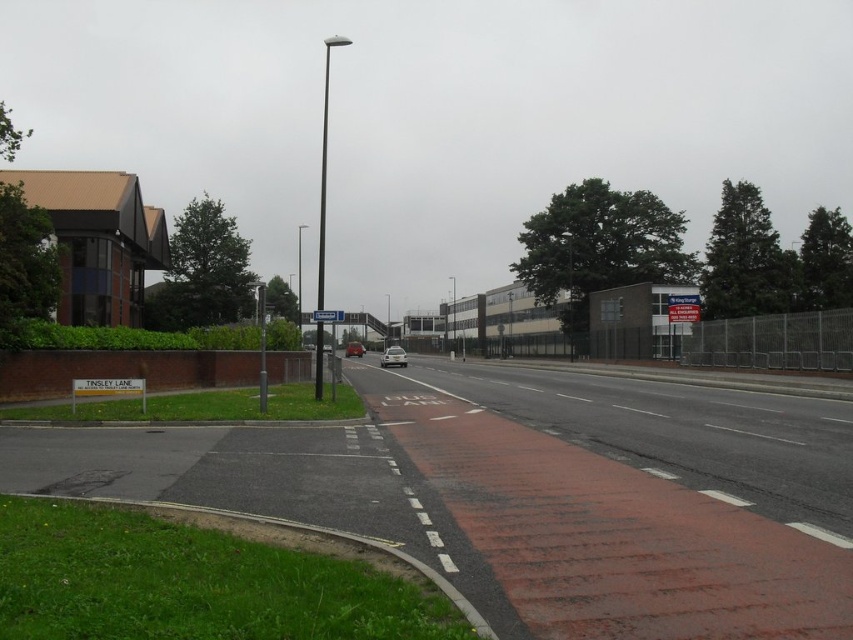
Who is more forward, (x=830, y=529) or (x=363, y=353)?

Point (x=830, y=529) is more forward.

Looking at this image, between red brick sidewalk at center and matte silver car at center, which one appears on the left side from the viewer's perspective?

From the viewer's perspective, matte silver car at center appears more on the left side.

Is point (761, 420) in front of point (347, 346)?

Yes.

I want to click on red brick sidewalk at center, so click(x=635, y=499).

Does red brick sidewalk at center have a smaller size compared to silver metallic car at center?

Correct, red brick sidewalk at center occupies less space than silver metallic car at center.

Does red brick sidewalk at center appear on the left side of silver metallic car at center?

In fact, red brick sidewalk at center is to the right of silver metallic car at center.

Does point (540, 564) come behind point (395, 355)?

No.

Find the location of a particular element. This screenshot has height=640, width=853. red brick sidewalk at center is located at coordinates (635, 499).

Is silver metallic car at center smaller than matte silver car at center?

Indeed, silver metallic car at center has a smaller size compared to matte silver car at center.

Does point (402, 355) lie in front of point (346, 352)?

Yes.

This screenshot has width=853, height=640. I want to click on silver metallic car at center, so click(393, 356).